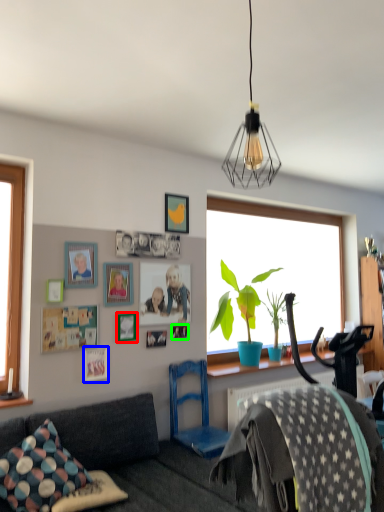
Question: Which is nearer to the picture frame (highlighted by a red box)? picture frame (highlighted by a blue box) or picture frame (highlighted by a green box).

Choices:
 (A) picture frame
 (B) picture frame

Answer: (A)